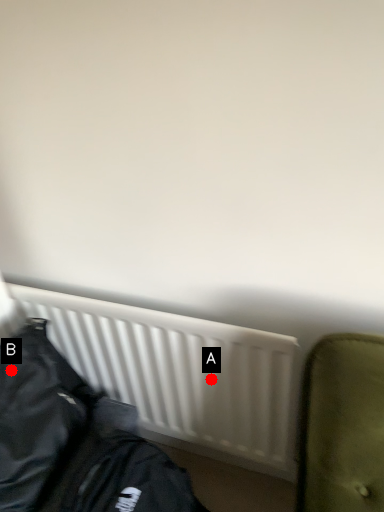
Question: Two points are circled on the image, labeled by A and B beside each circle. Which point is closer to the camera taking this photo?

Choices:
 (A) A is closer
 (B) B is closer

Answer: (B)